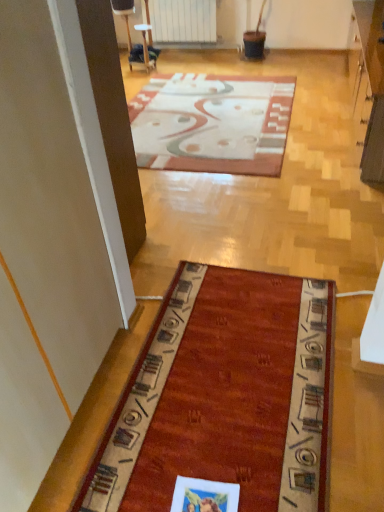
Question: Is white matte radiator at upper center inside or outside of patterned carpet at center?

Choices:
 (A) outside
 (B) inside

Answer: (A)

Question: Considering the positions of white matte radiator at upper center and patterned carpet at center in the image, is white matte radiator at upper center bigger or smaller than patterned carpet at center?

Choices:
 (A) big
 (B) small

Answer: (B)

Question: Is white matte radiator at upper center in front of or behind patterned carpet at center in the image?

Choices:
 (A) front
 (B) behind

Answer: (B)

Question: In terms of width, does patterned carpet at center look wider or thinner when compared to white matte radiator at upper center?

Choices:
 (A) thin
 (B) wide

Answer: (B)

Question: Considering the positions of patterned carpet at center and white matte radiator at upper center in the image, is patterned carpet at center taller or shorter than white matte radiator at upper center?

Choices:
 (A) tall
 (B) short

Answer: (B)

Question: Is point (187, 165) closer or farther from the camera than point (185, 33)?

Choices:
 (A) closer
 (B) farther

Answer: (A)

Question: Relative to white matte radiator at upper center, is patterned carpet at center in front or behind?

Choices:
 (A) behind
 (B) front

Answer: (B)